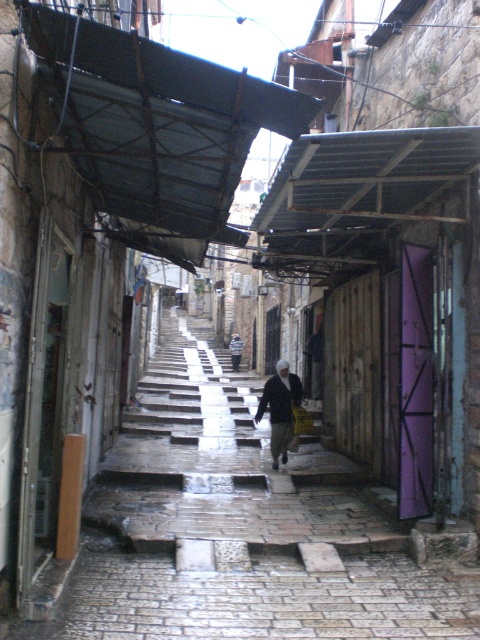
Question: Which of these objects is positioned closest to the white woolen hat at center?

Choices:
 (A) metallic corrugated roof at upper center
 (B) striped fabric jacket at center

Answer: (A)

Question: Among these points, which one is farthest from the camera?

Choices:
 (A) (279, 381)
 (B) (92, 83)
 (C) (273, 392)
 (D) (123, 413)

Answer: (D)

Question: Is stone textured stairs at center thinner than dark gray woolen jacket at center?

Choices:
 (A) yes
 (B) no

Answer: (B)

Question: Does metallic corrugated roof at upper center come in front of striped fabric jacket at center?

Choices:
 (A) no
 (B) yes

Answer: (B)

Question: Can you confirm if stone textured stairs at center is wider than white woolen hat at center?

Choices:
 (A) yes
 (B) no

Answer: (A)

Question: Which point is closer to the camera taking this photo?

Choices:
 (A) (231, 344)
 (B) (224, 122)
 (C) (279, 477)
 (D) (278, 406)

Answer: (B)